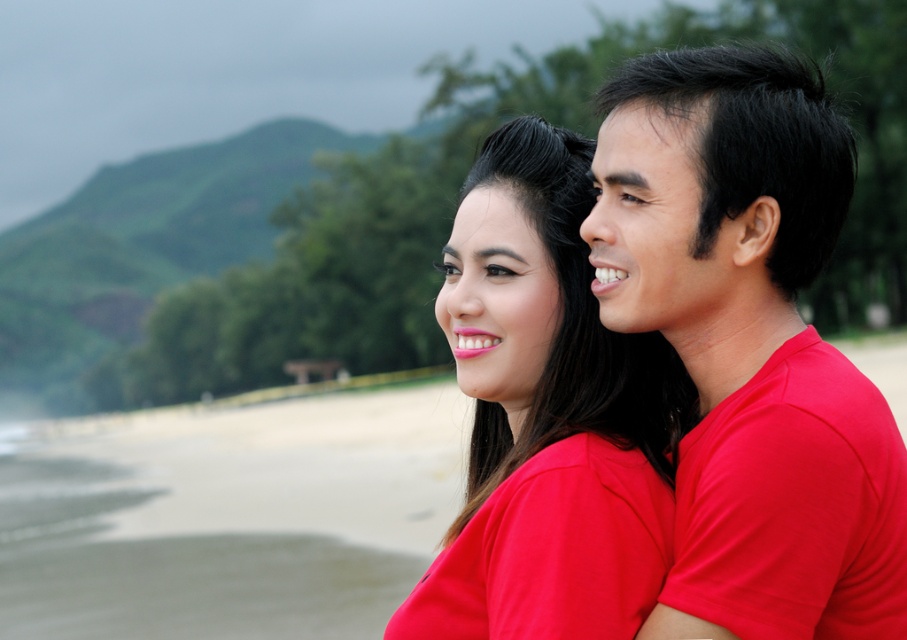
Can you confirm if matte red t-shirt at right is positioned above matte red shirt at center?

Correct, matte red t-shirt at right is located above matte red shirt at center.

In the scene shown: Does matte red t-shirt at right lie behind matte red shirt at center?

No, matte red t-shirt at right is closer to the viewer.

Is point (766, 209) positioned after point (496, 627)?

No, (766, 209) is closer to viewer.

Find the location of a particular element. Image resolution: width=907 pixels, height=640 pixels. matte red t-shirt at right is located at coordinates (749, 346).